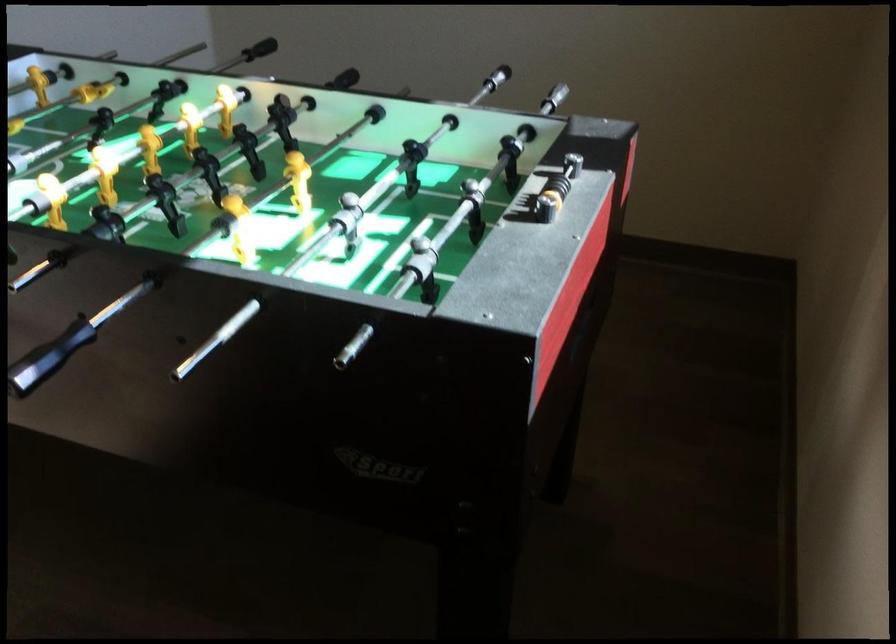
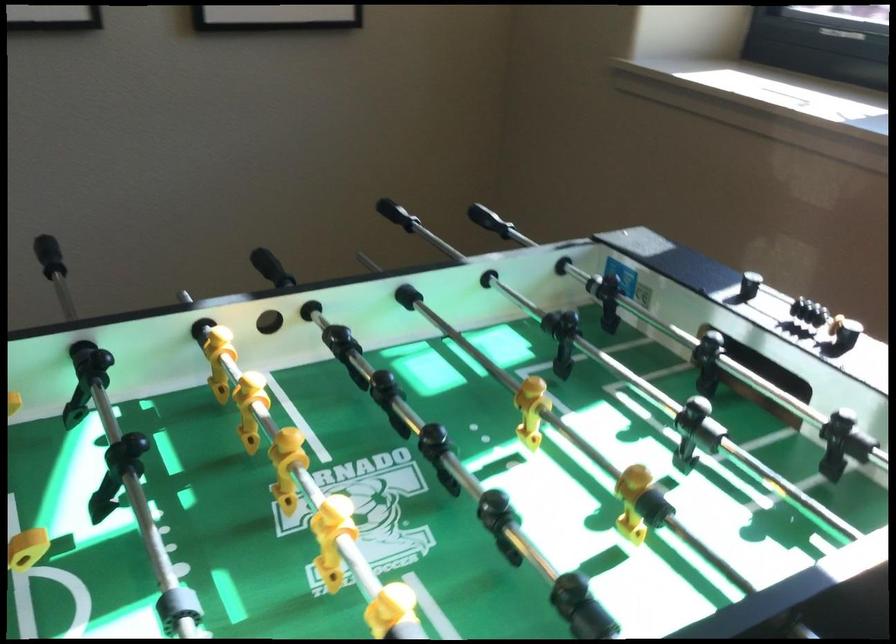
Locate, in the second image, the point that corresponds to point (597, 202) in the first image.

(819, 315)